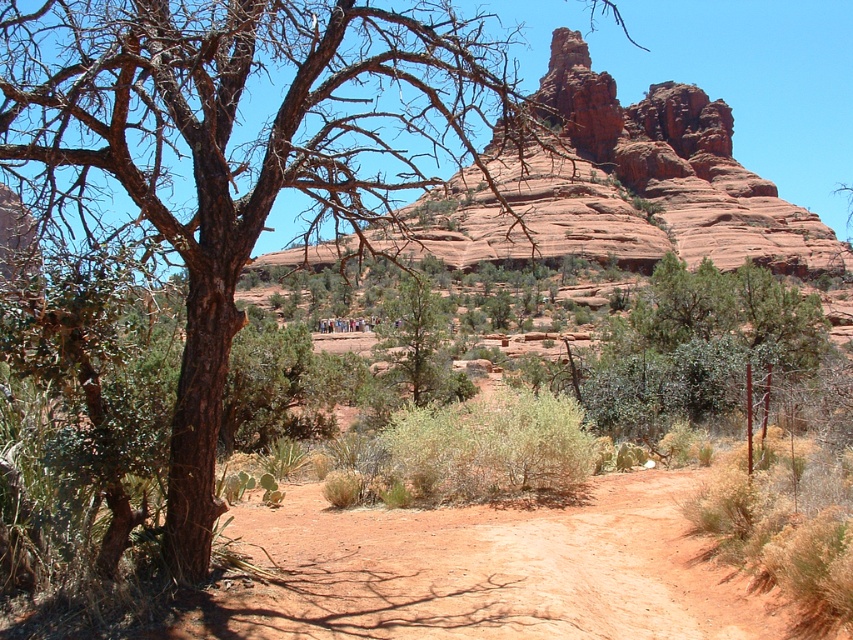
Question: Which point is farther from the camera taking this photo?

Choices:
 (A) (430, 305)
 (B) (206, 410)
 (C) (640, 630)

Answer: (A)

Question: Considering the relative positions of dusty reddish-brown dirt track at center and green textured tree at center in the image provided, where is dusty reddish-brown dirt track at center located with respect to green textured tree at center?

Choices:
 (A) right
 (B) left

Answer: (A)

Question: Which of these objects is positioned closest to the green textured tree at center?

Choices:
 (A) dusty reddish-brown dirt track at center
 (B) brown rough bark tree at left

Answer: (A)

Question: Among these points, which one is nearest to the camera?

Choices:
 (A) 126,152
 (B) 427,301
 (C) 637,499

Answer: (A)

Question: Does brown rough bark tree at left have a larger size compared to green textured tree at center?

Choices:
 (A) no
 (B) yes

Answer: (B)

Question: Considering the relative positions of brown rough bark tree at left and dusty reddish-brown dirt track at center in the image provided, where is brown rough bark tree at left located with respect to dusty reddish-brown dirt track at center?

Choices:
 (A) below
 (B) above

Answer: (B)